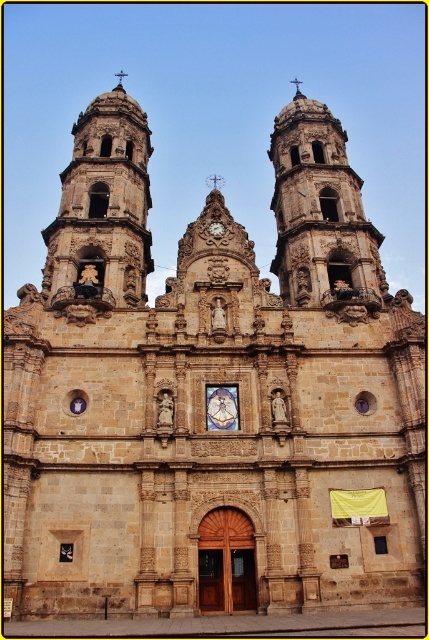
You are standing in front of the church and want to take a photo of the brown stone tower at left and the stone tower at center. Which tower should you position to your left side to capture both in the frame?

You should position the brown stone tower at left to your left side since it is already to the left of the stone tower at center, allowing both towers to be captured in the frame when aligned properly.

You are standing at the entrance of the grand historic church. You notice a stone tower at center and a gold ornate clock at center. How far apart are these two features from each other?

The stone tower at center is 18.64 meters from the gold ornate clock at center.

You are standing in front of the grand historic church and want to take a photo of the brown stone tower at left. Which direction should you turn to face the tower?

The brown stone tower at left is located at point (102, 209), which is to the left side of the facade. To face the tower, you should turn to your left.